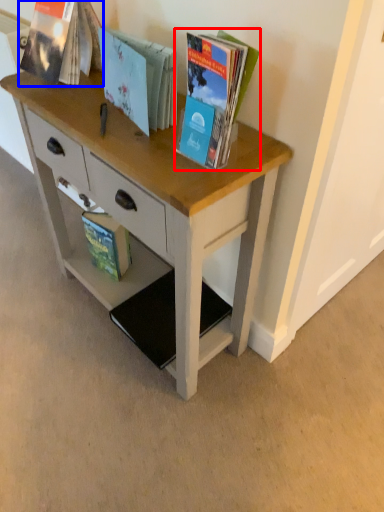
Question: Among these objects, which one is farthest to the camera, book (highlighted by a red box) or book (highlighted by a blue box)?

Choices:
 (A) book
 (B) book

Answer: (B)